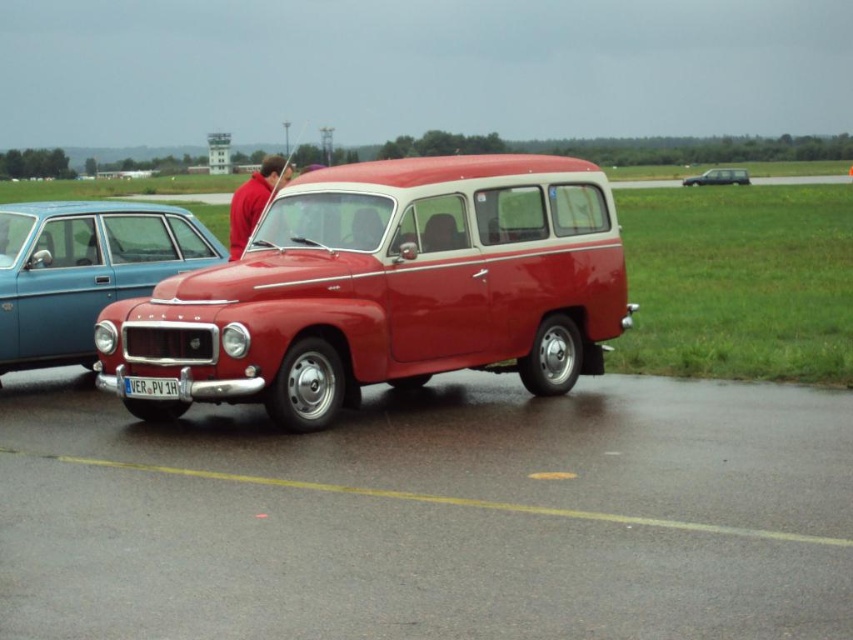
You are standing at the edge of the runway and see the glossy asphalt tarmac at center and the matte blue sedan at left. Which object is nearer to you?

The glossy asphalt tarmac at center is closer to the viewer than the matte blue sedan at left, so the glossy asphalt tarmac at center is nearer to you.

You are standing at the point labeled as point (265,184) and want to walk to the point labeled as point (618,330). Which direction should you face to walk towards your destination?

You should face forward because point (618,330) is in front of point (265,184).